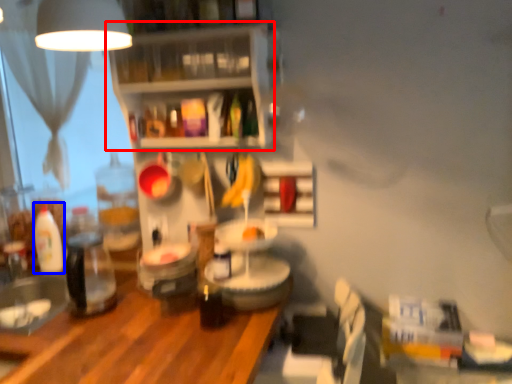
Question: Which point is closer to the camera, shelf (highlighted by a red box) or bottle (highlighted by a blue box)?

Choices:
 (A) shelf
 (B) bottle

Answer: (A)